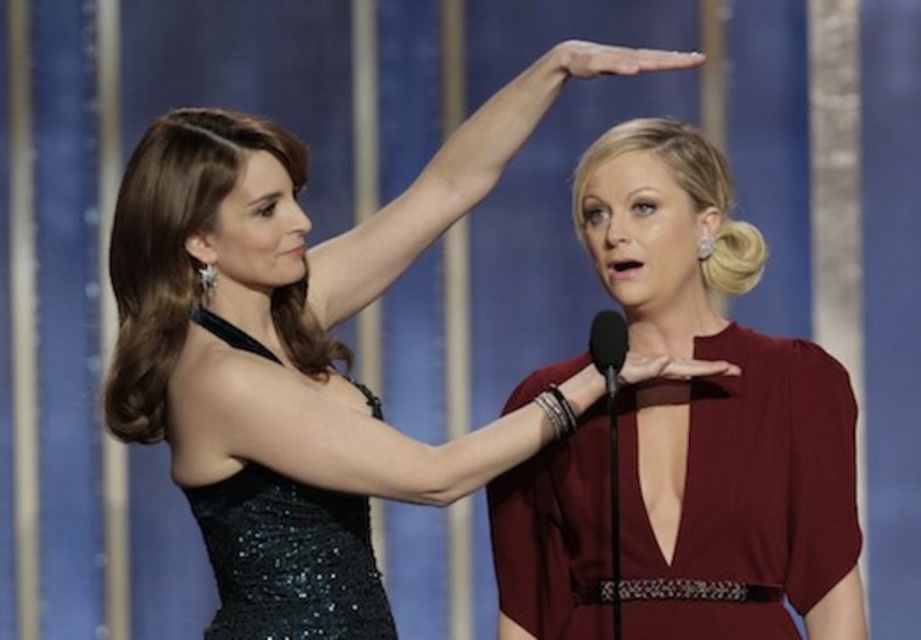
You are a photographer at the event and want to capture both the burgundy satin dress at center and the sequined black dress at center in a single photo. Which dress should you focus on first to ensure both are in frame?

You should focus on the burgundy satin dress at center first because it is closer to you than the sequined black dress at center, so by focusing on it, the sequined black dress at center will also be in focus if they are within the same focal plane.

You are a photographer at an awards ceremony. You need to position a spotlight so it shines equally on both the burgundy satin dress at center and the black sequined dress at upper left. Given their positions, which dress should the spotlight be placed closer to?

The spotlight should be placed closer to the black sequined dress at upper left because the burgundy satin dress at center is to the right of it, so positioning the spotlight closer to the left side would ensure equal illumination.